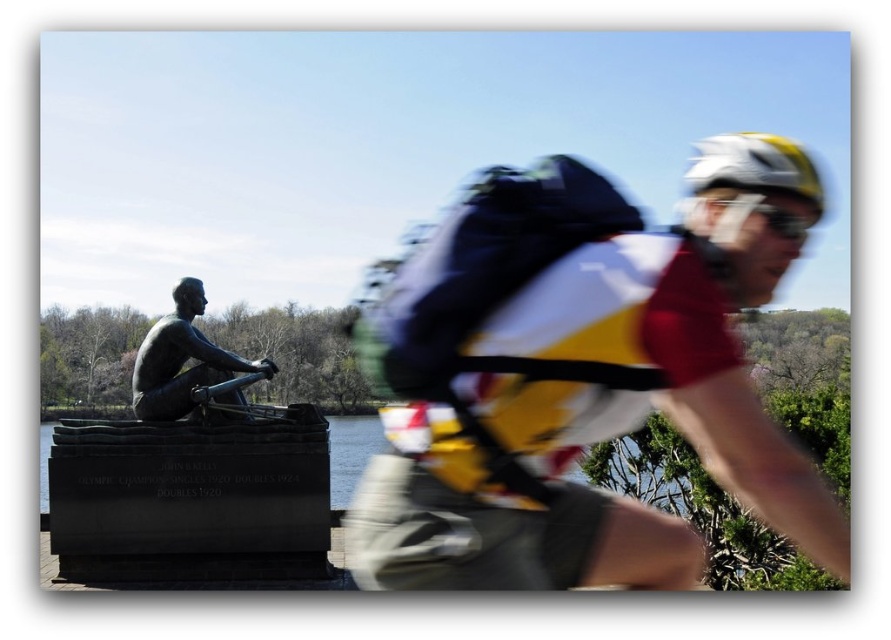
You are a delivery drone operator. Your drone is currently hovering at the yellow and white jersey at center. You need to deliver a package to the white matte helmet at upper right. The drone has a maximum delivery range of 30 feet. Can the drone make this delivery without needing to recharge?

The distance between the yellow and white jersey at center and the white matte helmet at upper right is 27.87 feet, which is within the drone delivery range of 30 feet. Therefore, the drone can deliver the package without needing to recharge.

You are a photographer trying to capture a clear shot of both the yellow and white jersey at center and the white matte bicycle helmet at upper right. Which object should you focus on to ensure it appears sharp in the photo?

You should focus on the white matte bicycle helmet at upper right because it is stationary, while the yellow and white jersey at center is moving, causing blur.